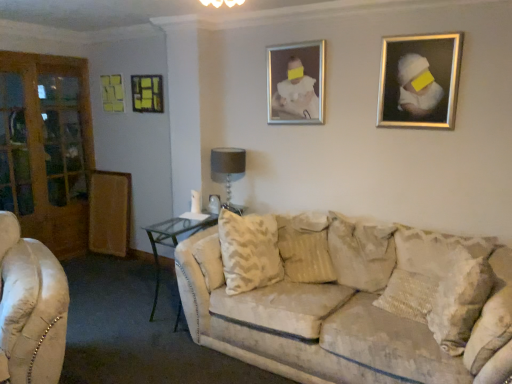
Question: Which direction should I rotate to look at silver metallic picture frame at upper center, the 3th picture frame when ordered from back to front, — up or down?

Choices:
 (A) down
 (B) up

Answer: (B)

Question: Does clear glass table at center have a greater height compared to beige textured pillow at center, which is the 1th pillow in left-to-right order?

Choices:
 (A) no
 (B) yes

Answer: (B)

Question: Is clear glass table at center surrounding beige textured pillow at center, which is the 1th pillow in left-to-right order?

Choices:
 (A) yes
 (B) no

Answer: (B)

Question: Considering the relative positions of clear glass table at center and beige textured pillow at center, the 3th pillow viewed from the right, in the image provided, is clear glass table at center in front of beige textured pillow at center, the 3th pillow viewed from the right,?

Choices:
 (A) no
 (B) yes

Answer: (A)

Question: Does clear glass table at center have a lesser width compared to beige textured pillow at center, which is the 1th pillow in left-to-right order?

Choices:
 (A) no
 (B) yes

Answer: (A)

Question: From a real-world perspective, is clear glass table at center physically above beige textured pillow at center, the 3th pillow viewed from the right?

Choices:
 (A) no
 (B) yes

Answer: (A)

Question: Can you confirm if clear glass table at center is positioned to the left of beige textured pillow at center, the 3th pillow viewed from the right?

Choices:
 (A) yes
 (B) no

Answer: (A)

Question: Considering the relative sizes of clear glass table at center and textured beige pillow at center, placed as the second pillow when sorted from left to right, in the image provided, is clear glass table at center bigger than textured beige pillow at center, placed as the second pillow when sorted from left to right,?

Choices:
 (A) yes
 (B) no

Answer: (A)

Question: From a real-world perspective, is clear glass table at center under textured beige pillow at center, placed as the second pillow when sorted from left to right?

Choices:
 (A) no
 (B) yes

Answer: (B)

Question: Considering the relative positions of clear glass table at center and textured beige pillow at center, acting as the second pillow starting from the right, in the image provided, is clear glass table at center to the left of textured beige pillow at center, acting as the second pillow starting from the right, from the viewer's perspective?

Choices:
 (A) yes
 (B) no

Answer: (A)

Question: Considering the relative sizes of clear glass table at center and textured beige pillow at center, acting as the second pillow starting from the right, in the image provided, is clear glass table at center shorter than textured beige pillow at center, acting as the second pillow starting from the right,?

Choices:
 (A) no
 (B) yes

Answer: (A)

Question: Is clear glass table at center beside textured beige pillow at center, placed as the second pillow when sorted from left to right?

Choices:
 (A) yes
 (B) no

Answer: (B)

Question: From the image's perspective, is clear glass table at center below textured beige pillow at center, acting as the second pillow starting from the right?

Choices:
 (A) no
 (B) yes

Answer: (B)

Question: Is beige textured pillow at center, the 3th pillow viewed from the right, far away from textured beige pillow at right, the 1th pillow in the right-to-left sequence?

Choices:
 (A) yes
 (B) no

Answer: (B)